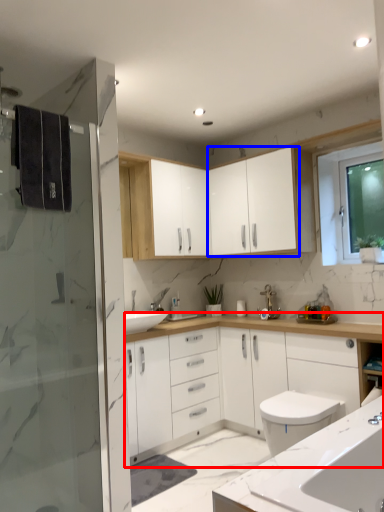
Question: Which object appears closest to the camera in this image, bathroom cabinet (highlighted by a red box) or cabinetry (highlighted by a blue box)?

Choices:
 (A) bathroom cabinet
 (B) cabinetry

Answer: (A)